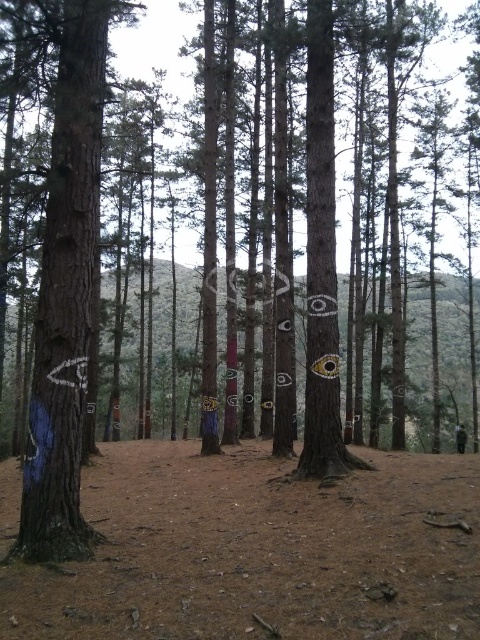
Consider the image. Which is more to the left, blue painted tree trunk at left or black leather jacket at center?

Positioned to the left is blue painted tree trunk at left.

Is blue painted tree trunk at left in front of black leather jacket at center?

Yes, it is in front of black leather jacket at center.

Is point (49, 205) positioned after point (460, 426)?

No, it is in front of (460, 426).

What are the coordinates of `blue painted tree trunk at left` in the screenshot? It's located at (67, 294).